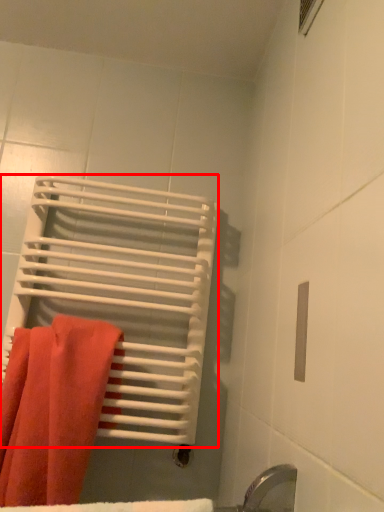
Question: From the image's perspective, what is the correct spatial positioning of bath towel (annotated by the red box) in reference to towel?

Choices:
 (A) above
 (B) below

Answer: (A)